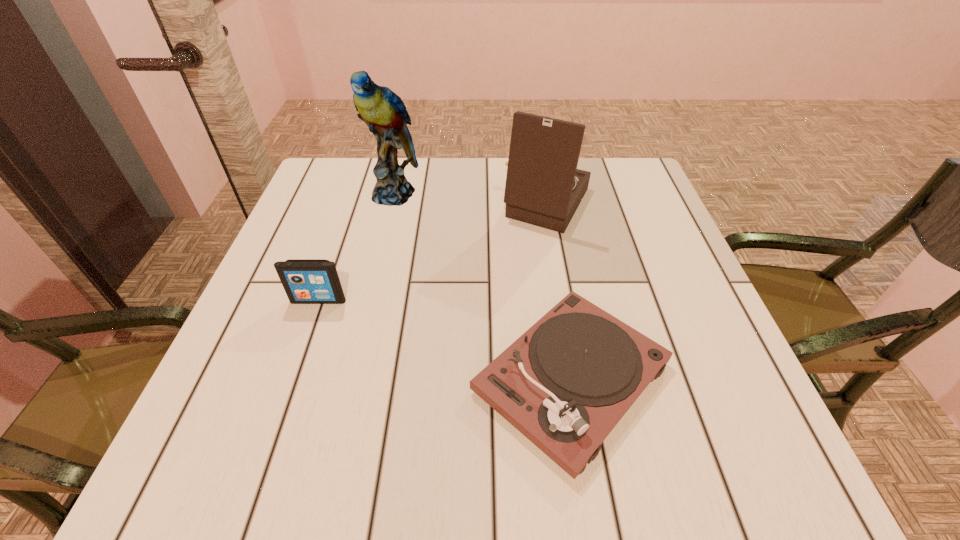
Identify the location of parrot. Image resolution: width=960 pixels, height=540 pixels. [383, 111].

Find the location of `the farther phonograph_record`. the farther phonograph_record is located at coordinates (x=544, y=188).

Find the location of a particular element. the third shortest object is located at coordinates (544, 188).

Locate an element on the screen. The image size is (960, 540). the second shortest object is located at coordinates [306, 281].

This screenshot has width=960, height=540. I want to click on the shorter phonograph_record, so click(x=565, y=383).

Find the location of `the shortest object`. the shortest object is located at coordinates (565, 383).

Find the location of `vacant space located on the face of the parrot`. vacant space located on the face of the parrot is located at coordinates (367, 307).

At what (x,y) coordinates should I click in order to perform the action: click on free space located 0.210m on the left of the taller phonograph_record. Please return your answer as a coordinate pair (x, y). Image resolution: width=960 pixels, height=540 pixels. Looking at the image, I should click on (419, 204).

Where is `free space located 0.300m on the front screen of the iPod`? The height and width of the screenshot is (540, 960). free space located 0.300m on the front screen of the iPod is located at coordinates (265, 455).

Locate an element on the screen. The width and height of the screenshot is (960, 540). vacant region located on the left of the nearer phonograph_record is located at coordinates [324, 378].